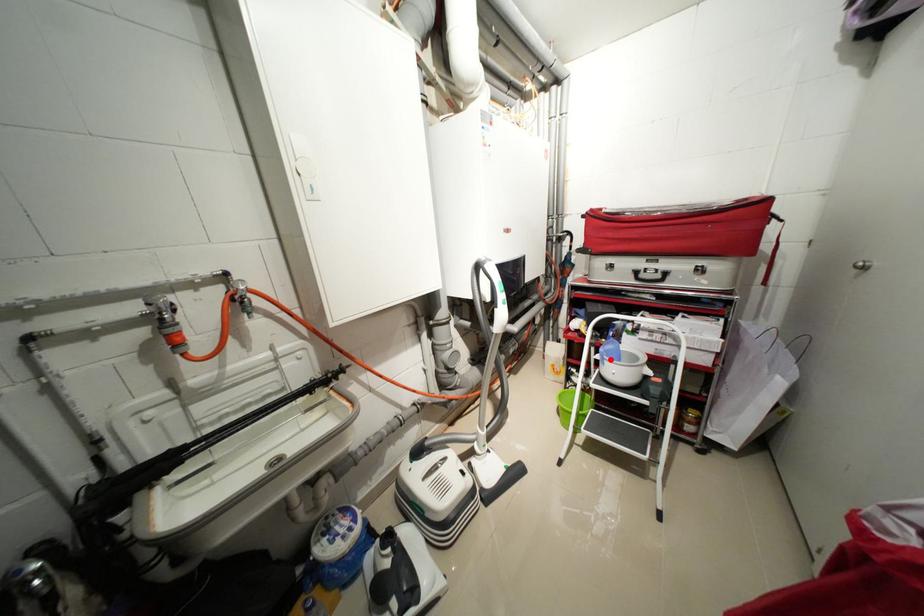
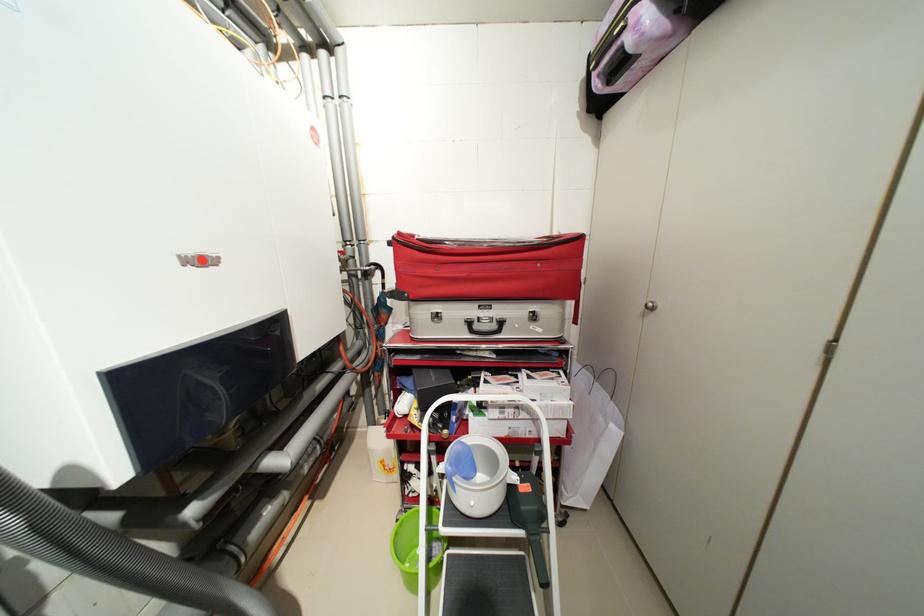
Find the pixel in the second image that matches the highlighted location in the first image.

(459, 485)